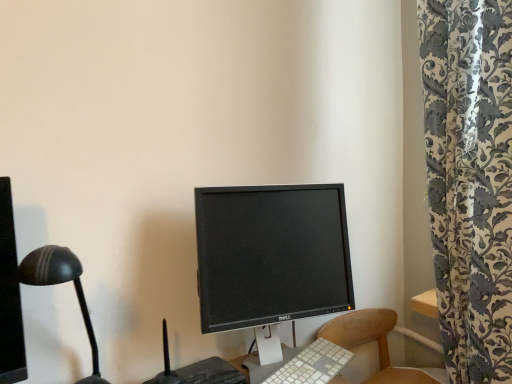
Question: From a real-world perspective, is black glossy monitor at center located higher than wooden chair at lower right?

Choices:
 (A) yes
 (B) no

Answer: (A)

Question: Does black glossy monitor at center turn towards wooden chair at lower right?

Choices:
 (A) yes
 (B) no

Answer: (B)

Question: From the image's perspective, is black glossy monitor at center on top of wooden chair at lower right?

Choices:
 (A) no
 (B) yes

Answer: (B)

Question: Does black glossy monitor at center appear on the right side of wooden chair at lower right?

Choices:
 (A) yes
 (B) no

Answer: (B)

Question: Is black glossy monitor at center outside of wooden chair at lower right?

Choices:
 (A) yes
 (B) no

Answer: (A)

Question: Can you confirm if black glossy monitor at center is positioned to the left of wooden chair at lower right?

Choices:
 (A) yes
 (B) no

Answer: (A)

Question: From the image's perspective, would you say black matte desk lamp at left is shown under wooden chair at lower right?

Choices:
 (A) yes
 (B) no

Answer: (B)

Question: Are black matte desk lamp at left and wooden chair at lower right located far from each other?

Choices:
 (A) no
 (B) yes

Answer: (B)

Question: Is black matte desk lamp at left positioned beyond the bounds of wooden chair at lower right?

Choices:
 (A) no
 (B) yes

Answer: (B)

Question: From a real-world perspective, is black matte desk lamp at left below wooden chair at lower right?

Choices:
 (A) no
 (B) yes

Answer: (A)

Question: Can you confirm if black matte desk lamp at left is smaller than wooden chair at lower right?

Choices:
 (A) yes
 (B) no

Answer: (A)

Question: Is black matte desk lamp at left wider than wooden chair at lower right?

Choices:
 (A) no
 (B) yes

Answer: (A)

Question: Does white plastic keyboard at center have a lesser width compared to black matte desk lamp at left?

Choices:
 (A) yes
 (B) no

Answer: (A)